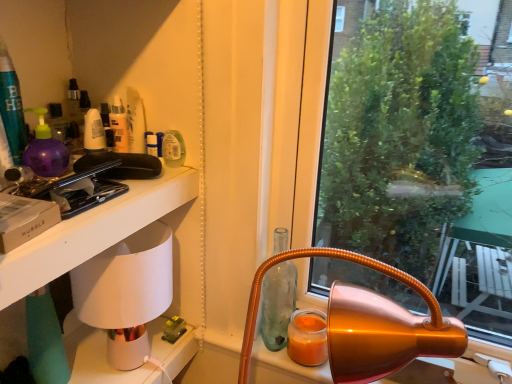
Question: Considering the relative sizes of white ceramic lamp at left and white matte table at left in the image provided, is white ceramic lamp at left wider than white matte table at left?

Choices:
 (A) yes
 (B) no

Answer: (B)

Question: Can white matte table at left be found inside white ceramic lamp at left?

Choices:
 (A) yes
 (B) no

Answer: (B)

Question: Is there a large distance between white ceramic lamp at left and white matte table at left?

Choices:
 (A) yes
 (B) no

Answer: (B)

Question: Considering the relative positions of white ceramic lamp at left and white matte table at left in the image provided, is white ceramic lamp at left to the right of white matte table at left from the viewer's perspective?

Choices:
 (A) yes
 (B) no

Answer: (A)

Question: Does white ceramic lamp at left have a greater height compared to white matte table at left?

Choices:
 (A) yes
 (B) no

Answer: (A)

Question: Can you confirm if white ceramic lamp at left is smaller than white matte table at left?

Choices:
 (A) no
 (B) yes

Answer: (B)

Question: Is orange matte candle at lower right at the left side of white matte table at left?

Choices:
 (A) yes
 (B) no

Answer: (B)

Question: From a real-world perspective, is orange matte candle at lower right positioned over white matte table at left based on gravity?

Choices:
 (A) no
 (B) yes

Answer: (A)

Question: From the image's perspective, would you say orange matte candle at lower right is shown under white matte table at left?

Choices:
 (A) yes
 (B) no

Answer: (A)

Question: Is orange matte candle at lower right smaller than white matte table at left?

Choices:
 (A) yes
 (B) no

Answer: (A)

Question: Does orange matte candle at lower right lie behind white matte table at left?

Choices:
 (A) yes
 (B) no

Answer: (A)

Question: Does orange matte candle at lower right have a lesser height compared to white matte table at left?

Choices:
 (A) no
 (B) yes

Answer: (B)

Question: Is orange matte candle at lower right a part of white ceramic lamp at left?

Choices:
 (A) yes
 (B) no

Answer: (B)